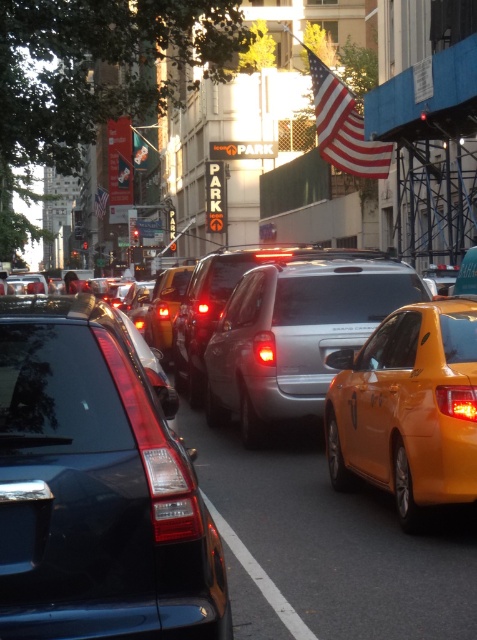
Question: Is glossy black sedan at left to the right of satin silver van at center from the viewer's perspective?

Choices:
 (A) no
 (B) yes

Answer: (A)

Question: Among these points, which one is nearest to the camera?

Choices:
 (A) (335, 330)
 (B) (210, 509)
 (C) (172, 294)
 (D) (350, 371)

Answer: (B)

Question: Can you confirm if orange matte taxi at right is positioned above white rubber line at center?

Choices:
 (A) no
 (B) yes

Answer: (B)

Question: Does orange matte taxi at right have a lesser width compared to white rubber line at center?

Choices:
 (A) no
 (B) yes

Answer: (A)

Question: Which object is positioned farthest from the glossy black sedan at left?

Choices:
 (A) white rubber line at center
 (B) orange matte taxi at right
 (C) yellow matte taxi at center
 (D) satin silver van at center

Answer: (C)

Question: Which of these objects is positioned farthest from the yellow matte taxi at center?

Choices:
 (A) orange matte taxi at right
 (B) white rubber line at center
 (C) satin silver van at center
 (D) glossy black sedan at left

Answer: (D)